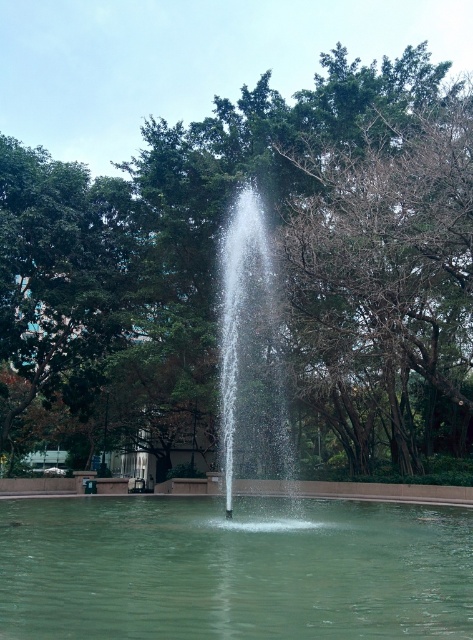
Please write a question based on the provided information without revealing the specific details in the Objects Description. The question should ask about the position of the green leafy tree at center relative to the fountain and the surrounding trees, ensuring that all object labels from Objects are mentioned exactly as given. The answer should use the Objects Description to determine the answer without leaking the coordinate details.

The green leafy tree at center is positioned at the center of the scene, making it the focal point among the surrounding trees. Since its coordinates place it centrally, it is equidistant from the fountain and other trees in the image.

You are standing at the edge of the green leafy tree at center and want to walk to the clear glass fountain at center. Which direction should you walk to get closer to the fountain?

→ The green leafy tree at center is bigger than the clear glass fountain at center, but since both are at the center, you should walk towards the center to reach the fountain.